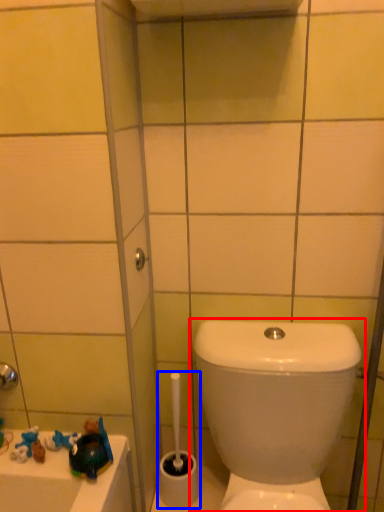
Question: Which object is closer to the camera taking this photo, toilet (highlighted by a red box) or brush (highlighted by a blue box)?

Choices:
 (A) toilet
 (B) brush

Answer: (A)